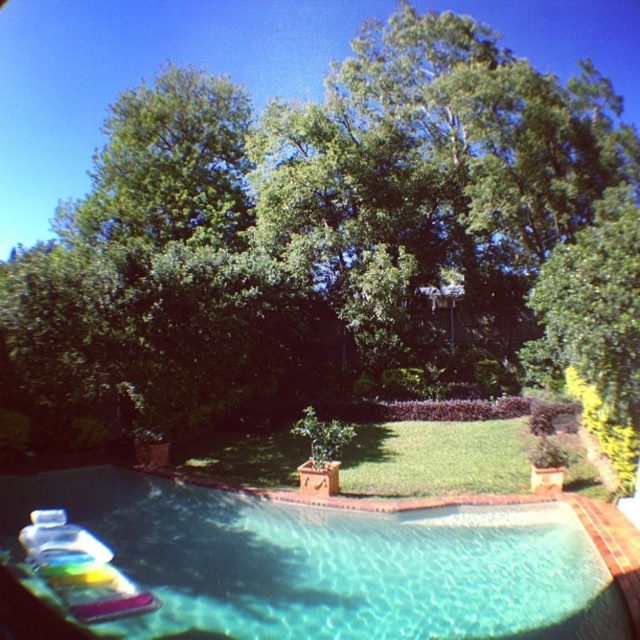
Does green leafy tree at upper center come in front of clear glass pool at lower center?

No, it is not.

Can you confirm if green leafy tree at upper center is positioned to the right of clear glass pool at lower center?

In fact, green leafy tree at upper center is to the left of clear glass pool at lower center.

Which is in front, point (202, 352) or point (285, 620)?

Point (285, 620) is more forward.

Locate an element on the screen. The width and height of the screenshot is (640, 640). green leafy tree at upper center is located at coordinates (307, 236).